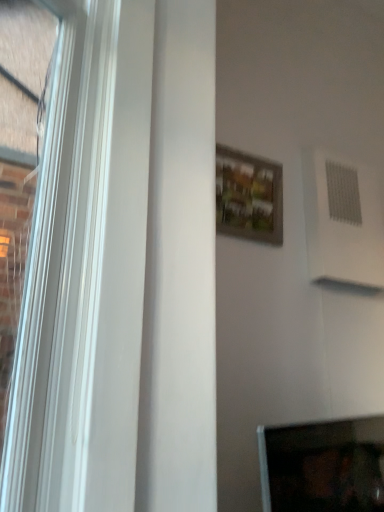
Question: In terms of width, does matte black monitor at lower right look wider or thinner when compared to wooden framed picture at center?

Choices:
 (A) wide
 (B) thin

Answer: (A)

Question: Is matte black monitor at lower right to the left or to the right of wooden framed picture at center in the image?

Choices:
 (A) left
 (B) right

Answer: (B)

Question: In the image, is matte black monitor at lower right positioned in front of or behind wooden framed picture at center?

Choices:
 (A) front
 (B) behind

Answer: (A)

Question: Considering the positions of wooden framed picture at center and matte black monitor at lower right in the image, is wooden framed picture at center taller or shorter than matte black monitor at lower right?

Choices:
 (A) tall
 (B) short

Answer: (A)

Question: In the image, is wooden framed picture at center on the left side or the right side of matte black monitor at lower right?

Choices:
 (A) left
 (B) right

Answer: (A)

Question: Is point (271, 207) closer or farther from the camera than point (327, 448)?

Choices:
 (A) farther
 (B) closer

Answer: (B)

Question: From the image's perspective, is wooden framed picture at center positioned above or below matte black monitor at lower right?

Choices:
 (A) above
 (B) below

Answer: (A)